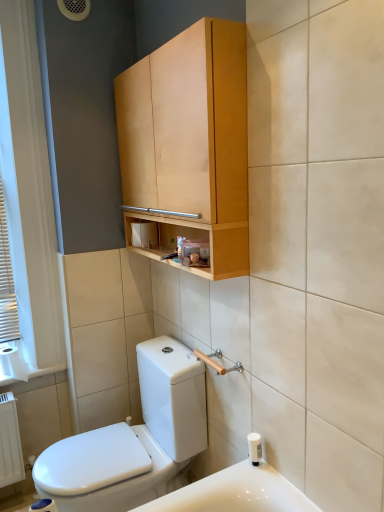
Question: From a real-world perspective, is white wooden blinds at left physically above white paper at left?

Choices:
 (A) no
 (B) yes

Answer: (B)

Question: From a real-world perspective, is white wooden blinds at left beneath white paper at left?

Choices:
 (A) no
 (B) yes

Answer: (A)

Question: Can you confirm if white wooden blinds at left is positioned to the left of white paper at left?

Choices:
 (A) no
 (B) yes

Answer: (B)

Question: Is white wooden blinds at left turned away from white paper at left?

Choices:
 (A) no
 (B) yes

Answer: (A)

Question: Can you confirm if white wooden blinds at left is taller than white paper at left?

Choices:
 (A) yes
 (B) no

Answer: (A)

Question: From the image's perspective, is white wooden blinds at left below white paper at left?

Choices:
 (A) no
 (B) yes

Answer: (A)

Question: Is white plastic soap dispenser at lower right far from white paper at left?

Choices:
 (A) no
 (B) yes

Answer: (B)

Question: Considering the relative positions of white plastic soap dispenser at lower right and white paper at left in the image provided, is white plastic soap dispenser at lower right to the left of white paper at left from the viewer's perspective?

Choices:
 (A) no
 (B) yes

Answer: (A)

Question: Considering the relative sizes of white plastic soap dispenser at lower right and white paper at left in the image provided, is white plastic soap dispenser at lower right shorter than white paper at left?

Choices:
 (A) no
 (B) yes

Answer: (B)

Question: Can we say white plastic soap dispenser at lower right lies outside white paper at left?

Choices:
 (A) no
 (B) yes

Answer: (B)

Question: Does white plastic soap dispenser at lower right appear on the right side of white paper at left?

Choices:
 (A) no
 (B) yes

Answer: (B)

Question: Considering the relative sizes of white plastic soap dispenser at lower right and white paper at left in the image provided, is white plastic soap dispenser at lower right bigger than white paper at left?

Choices:
 (A) yes
 (B) no

Answer: (B)

Question: Is white paper at left surrounding light wood cabinet at upper center?

Choices:
 (A) no
 (B) yes

Answer: (A)